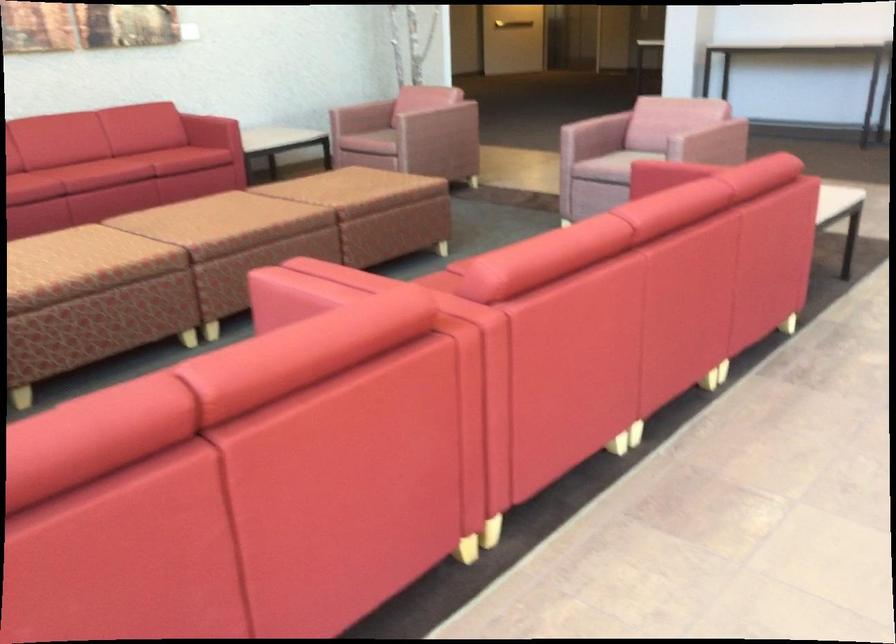
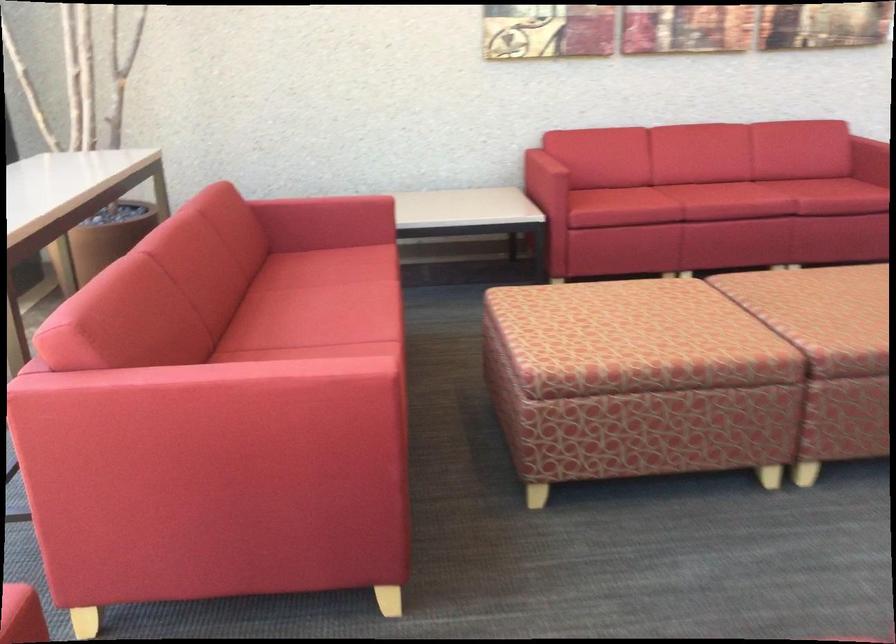
The point at (204, 225) is marked in the first image. Where is the corresponding point in the second image?

(834, 317)